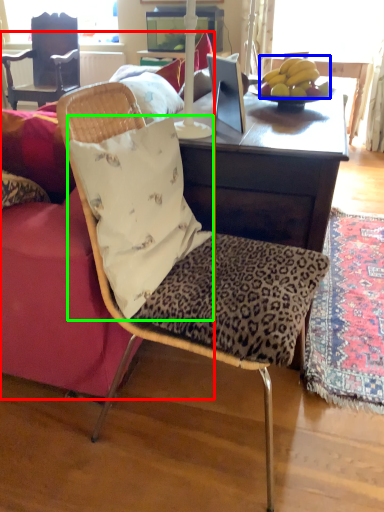
Question: Which object is the closest to the studio couch (highlighted by a red box)? Choose among these: banana (highlighted by a blue box) or pillow (highlighted by a green box).

Choices:
 (A) banana
 (B) pillow

Answer: (B)